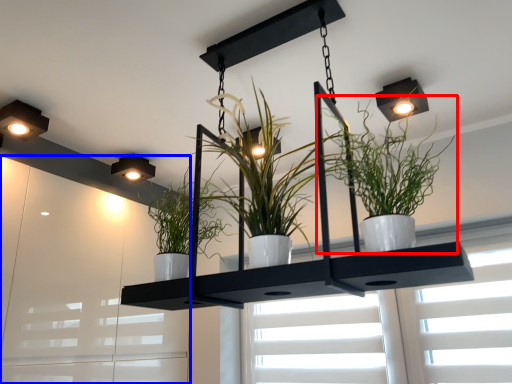
Question: Which point is further to the camera, houseplant (highlighted by a red box) or window frame (highlighted by a blue box)?

Choices:
 (A) houseplant
 (B) window frame

Answer: (B)